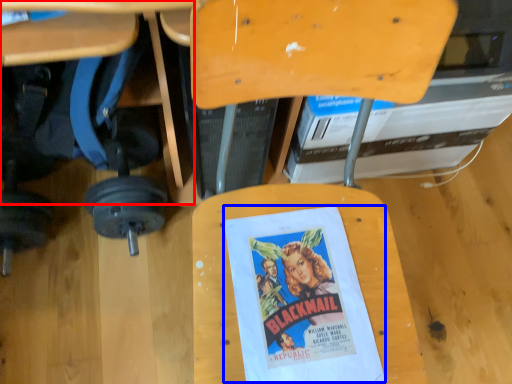
Question: Which of the following is the closest to the observer, table (highlighted by a red box) or movie poster (highlighted by a blue box)?

Choices:
 (A) table
 (B) movie poster

Answer: (A)